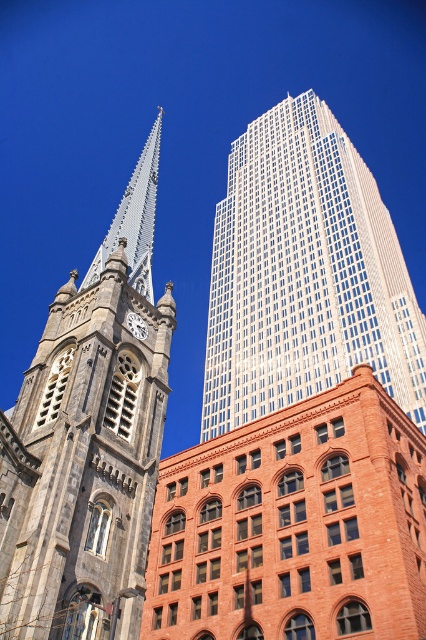
Can you confirm if gray stone tower at left is smaller than silver metallic spire at upper left?

Correct, gray stone tower at left occupies less space than silver metallic spire at upper left.

How far apart are gray stone tower at left and silver metallic spire at upper left?

gray stone tower at left and silver metallic spire at upper left are 9.31 meters apart from each other.

Where is `gray stone tower at left`? gray stone tower at left is located at coordinates (89, 440).

Between point (77, 404) and point (132, 333), which one is positioned in front?

Point (77, 404) is more forward.

Is gray stone tower at left closer to camera compared to matte gray clock at center?

That is True.

Who is more distant from viewer, (97, 554) or (141, 328)?

The point (141, 328) is more distant.

Image resolution: width=426 pixels, height=640 pixels. What are the coordinates of `gray stone tower at left` in the screenshot? It's located at coord(89,440).

Who is shorter, gray stone tower at left or white glass skyscraper at upper center?

Standing shorter between the two is white glass skyscraper at upper center.

What do you see at coordinates (89, 440) in the screenshot?
I see `gray stone tower at left` at bounding box center [89, 440].

At what (x,y) coordinates should I click in order to perform the action: click on gray stone tower at left. Please return your answer as a coordinate pair (x, y). Looking at the image, I should click on (89, 440).